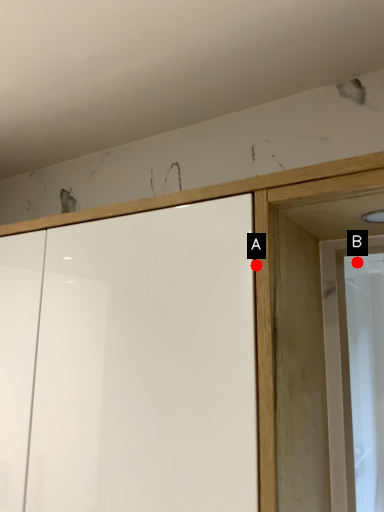
Question: Two points are circled on the image, labeled by A and B beside each circle. Which point is farther from the camera taking this photo?

Choices:
 (A) A is further
 (B) B is further

Answer: (B)